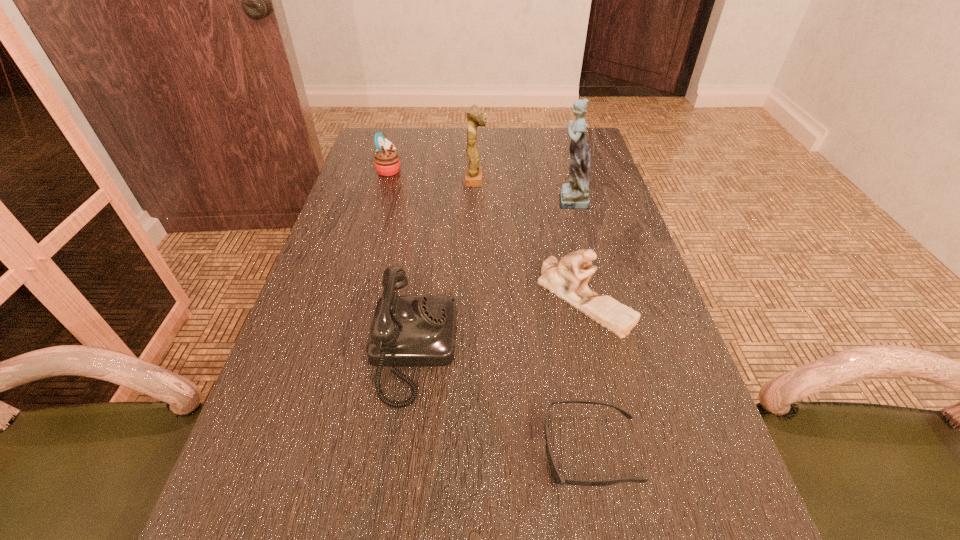
Where is `vacant area that lies between the sunglasses and the nearest figurine`? vacant area that lies between the sunglasses and the nearest figurine is located at coordinates (588, 374).

This screenshot has height=540, width=960. Identify the location of free space between the third object from left to right and the leftmost object. (432, 175).

Identify the location of unoccupied position between the second shortest figurine and the muffin. The width and height of the screenshot is (960, 540). (432, 175).

This screenshot has height=540, width=960. I want to click on vacant space that's between the leftmost object and the shortest figurine, so click(487, 234).

I want to click on free area in between the fourth nearest object and the shortest figurine, so click(x=577, y=249).

The height and width of the screenshot is (540, 960). Find the location of `unoccupied position between the leftmost figurine and the tallest figurine`. unoccupied position between the leftmost figurine and the tallest figurine is located at coordinates (522, 190).

Image resolution: width=960 pixels, height=540 pixels. In order to click on empty space that is in between the telephone and the fourth object from right to left in this screenshot , I will do `click(444, 265)`.

Where is `object that is the third nearest to the farthest figurine`? The image size is (960, 540). object that is the third nearest to the farthest figurine is located at coordinates (562, 278).

I want to click on the third closest object to the tallest figurine, so click(x=407, y=330).

Where is `figurine that stands as the closest to the second tallest figurine`? The width and height of the screenshot is (960, 540). figurine that stands as the closest to the second tallest figurine is located at coordinates (574, 195).